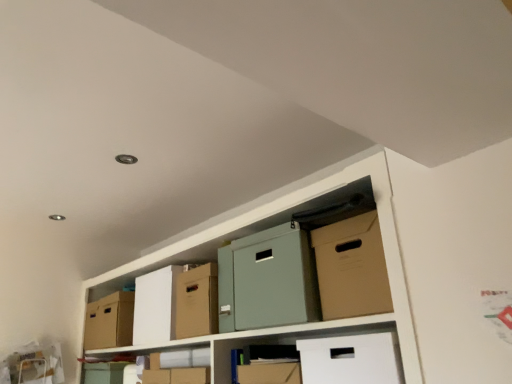
Question: Based on their sizes in the image, would you say matte cardboard box at center is bigger or smaller than cardboard box at center, placed as the second cardboard box when sorted from front to back?

Choices:
 (A) big
 (B) small

Answer: (A)

Question: From the image's perspective, is matte cardboard box at center located above or below cardboard box at center, marked as the second cardboard box in a right-to-left arrangement?

Choices:
 (A) below
 (B) above

Answer: (B)

Question: Which of these objects is positioned farthest from the cardboard box at left, which is the first cardboard box from back to front?

Choices:
 (A) matte cardboard box at lower center
 (B) cardboard box at center, marked as the second cardboard box in a right-to-left arrangement
 (C) brown cardboard box at upper right, placed as the first cardboard box when sorted from front to back
 (D) matte cardboard box at center

Answer: (C)

Question: Considering the real-world distances, which object is closest to the matte cardboard box at lower center?

Choices:
 (A) brown cardboard box at upper right, placed as the 1th cardboard box when sorted from right to left
 (B) cardboard box at center, marked as the second cardboard box in a right-to-left arrangement
 (C) matte cardboard box at center
 (D) cardboard box at left, arranged as the 1th cardboard box when viewed from the left

Answer: (D)